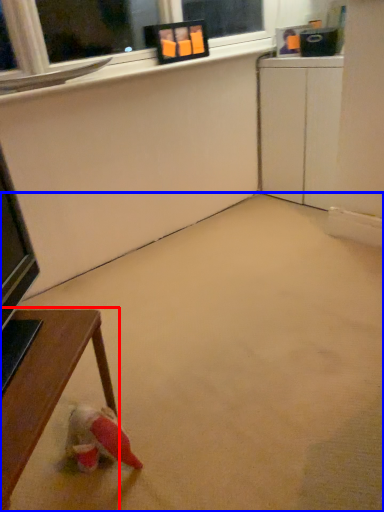
Question: Which point is further to the camera, table (highlighted by a red box) or concrete (highlighted by a blue box)?

Choices:
 (A) table
 (B) concrete

Answer: (A)